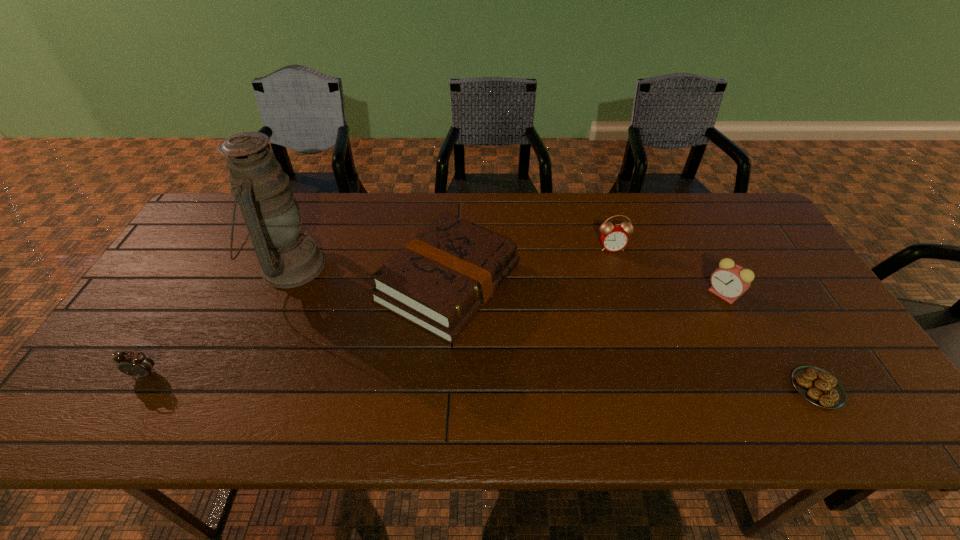
Where is `empty location between the rightmost object and the oil lamp`? empty location between the rightmost object and the oil lamp is located at coordinates (554, 327).

This screenshot has width=960, height=540. Find the location of `unoccupied position between the farthest alarm clock and the nearest alarm clock`. unoccupied position between the farthest alarm clock and the nearest alarm clock is located at coordinates [378, 310].

This screenshot has height=540, width=960. I want to click on unoccupied position between the second object from left to right and the rightmost alarm clock, so click(507, 280).

The width and height of the screenshot is (960, 540). What are the coordinates of `vacant region between the fourth object from right to left and the rightmost alarm clock` in the screenshot? It's located at point(586,288).

I want to click on vacant area that lies between the shortest object and the fifth object from left to right, so click(770, 341).

Locate an element on the screen. This screenshot has width=960, height=540. vacant area between the second object from left to right and the fifth object from left to right is located at coordinates (507, 280).

Where is `unoccupied position between the third object from left to right and the farthest alarm clock`? unoccupied position between the third object from left to right and the farthest alarm clock is located at coordinates (530, 265).

This screenshot has width=960, height=540. I want to click on empty location between the rightmost object and the tallest object, so click(x=554, y=327).

Locate an element on the screen. Image resolution: width=960 pixels, height=540 pixels. object that is the third nearest to the hardback book is located at coordinates (136, 364).

Locate which object is the fourth closest to the pastry. Please provide its 2D coordinates. Your answer should be formatted as a tuple, i.e. [(x, y)], where the tuple contains the x and y coordinates of a point satisfying the conditions above.

[(288, 258)]